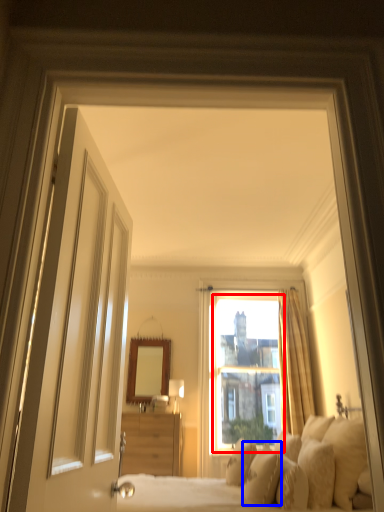
Question: Which object is further to the camera taking this photo, window screen (highlighted by a red box) or pillow (highlighted by a blue box)?

Choices:
 (A) window screen
 (B) pillow

Answer: (A)